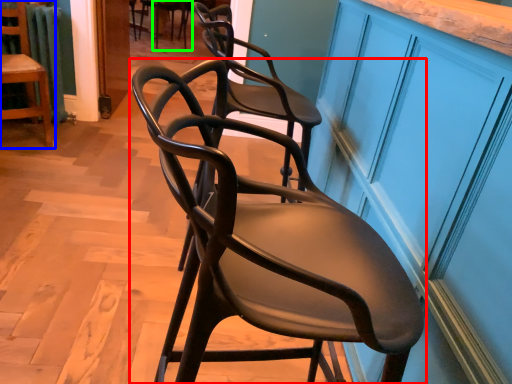
Question: Estimate the real-world distances between objects in this image. Which object is closer to chair (highlighted by a red box), chair (highlighted by a blue box) or chair (highlighted by a green box)?

Choices:
 (A) chair
 (B) chair

Answer: (A)